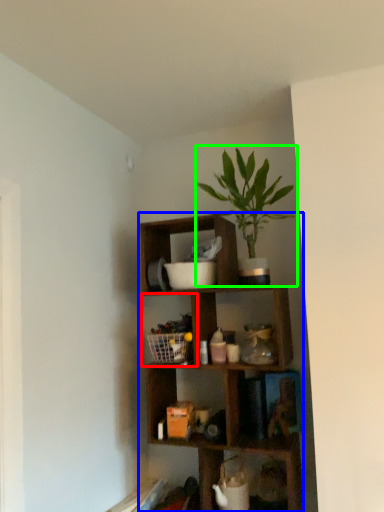
Question: Based on their relative distances, which object is nearer to cabinet (highlighted by a red box)? Choose from shelf (highlighted by a blue box) and houseplant (highlighted by a green box).

Choices:
 (A) shelf
 (B) houseplant

Answer: (A)